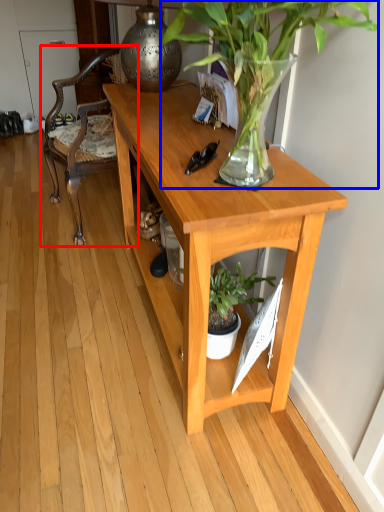
Question: Which of the following is the farthest to the observer, chair (highlighted by a red box) or houseplant (highlighted by a blue box)?

Choices:
 (A) chair
 (B) houseplant

Answer: (A)